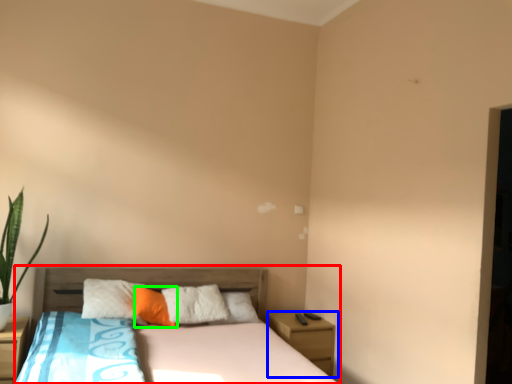
Question: Based on their relative distances, which object is farther from bed (highlighted by a red box)? Choose from nightstand (highlighted by a blue box) and pillow (highlighted by a green box).

Choices:
 (A) nightstand
 (B) pillow

Answer: (A)